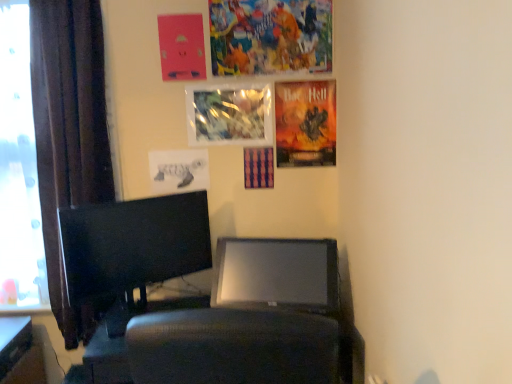
Question: Can you confirm if transparent glass window at left is positioned to the right of metallic reflective poster at upper center, which is counted as the 3th poster page, starting from the bottom?

Choices:
 (A) yes
 (B) no

Answer: (B)

Question: Is transparent glass window at left not within metallic reflective poster at upper center, which is counted as the 3th poster page, starting from the bottom?

Choices:
 (A) yes
 (B) no

Answer: (A)

Question: From a real-world perspective, is transparent glass window at left positioned over metallic reflective poster at upper center, which is counted as the 3th poster page, starting from the bottom, based on gravity?

Choices:
 (A) no
 (B) yes

Answer: (A)

Question: Does transparent glass window at left turn towards metallic reflective poster at upper center, the 3th poster page positioned from the top?

Choices:
 (A) yes
 (B) no

Answer: (B)

Question: Is transparent glass window at left positioned behind metallic reflective poster at upper center, the 3th poster page positioned from the top?

Choices:
 (A) yes
 (B) no

Answer: (B)

Question: Considering the relative positions of transparent glass window at left and metallic reflective poster at upper center, which is counted as the 3th poster page, starting from the bottom, in the image provided, is transparent glass window at left to the left of metallic reflective poster at upper center, which is counted as the 3th poster page, starting from the bottom, from the viewer's perspective?

Choices:
 (A) yes
 (B) no

Answer: (A)

Question: From a real-world perspective, is matte black desk at lower left physically below black glossy monitor at left?

Choices:
 (A) yes
 (B) no

Answer: (A)

Question: Could black glossy monitor at left be considered to be inside matte black desk at lower left?

Choices:
 (A) no
 (B) yes

Answer: (A)

Question: Is the surface of matte black desk at lower left in direct contact with black glossy monitor at left?

Choices:
 (A) no
 (B) yes

Answer: (A)

Question: Is matte black desk at lower left positioned before black glossy monitor at left?

Choices:
 (A) no
 (B) yes

Answer: (A)

Question: From the image's perspective, is matte black desk at lower left located beneath black glossy monitor at left?

Choices:
 (A) yes
 (B) no

Answer: (A)

Question: Would you consider matte black desk at lower left to be distant from black glossy monitor at left?

Choices:
 (A) no
 (B) yes

Answer: (A)

Question: Is metallic reflective poster at upper center, which is counted as the 3th poster page, starting from the bottom, wider than colorful collage at upper center, placed as the first poster page when sorted from top to bottom?

Choices:
 (A) yes
 (B) no

Answer: (A)